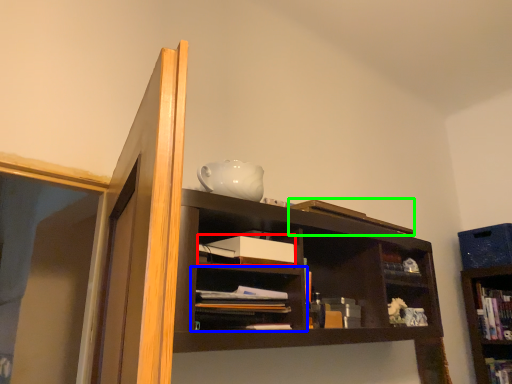
Question: Which is farther away from paperback book (highlighted by a red box)? shelf (highlighted by a blue box) or book (highlighted by a green box)?

Choices:
 (A) shelf
 (B) book

Answer: (B)